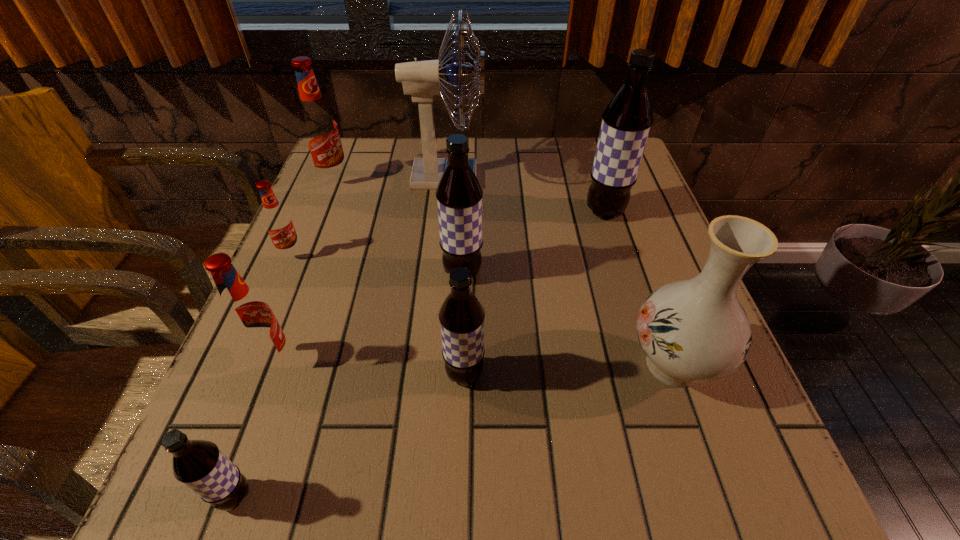
This screenshot has width=960, height=540. In order to click on free space that satisfies the following two spatial constraints: 1. on the front-facing side of the sixth nearest root beer; 2. on the right side of the fan in this screenshot , I will do `click(444, 212)`.

You are a GUI agent. You are given a task and a screenshot of the screen. Output one action in this format:
    pyautogui.click(x=<x>, y=<y>)
    Task: Click on the free spot that satisfies the following two spatial constraints: 1. on the back side of the nearest brown root beer; 2. on the right side of the third biggest brown root beer
    The height and width of the screenshot is (540, 960).
    Given the screenshot: What is the action you would take?
    pyautogui.click(x=278, y=374)

The image size is (960, 540). In order to click on free space that satisfies the following two spatial constraints: 1. on the front-facing side of the fan; 2. on the right side of the rightmost root beer in this screenshot , I will do `click(444, 212)`.